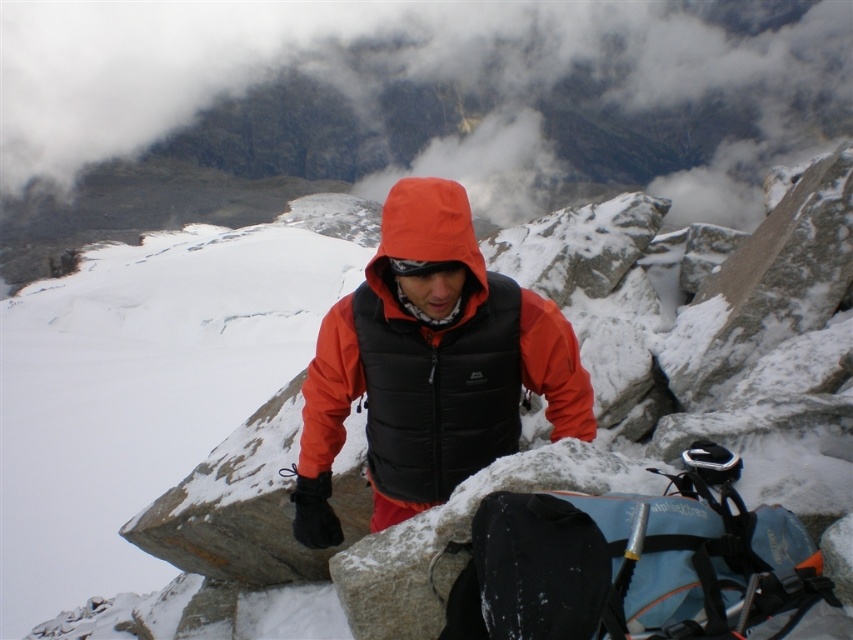
You are a drone operator tasked with capturing aerial footage of the orange softshell jacket at center and the cloudy fog at upper center. The drone has a maximum operational range of 300 meters. Can the drone safely capture footage of both objects without exceeding its range limit?

The cloudy fog at upper center and orange softshell jacket at center are 308.27 meters apart. Since the distance between them exceeds the drone operator maximum operational range of 300 meters, the drone cannot safely capture footage of both objects without exceeding its range limit.

Based on the photo, you are planning to take a photo of the cloudy fog at upper center and the orange softshell jacket at center. Based on their positions, which one should you focus on first to ensure both are in sharp focus?

The cloudy fog at upper center is above the orange softshell jacket at center, so you should focus on the cloudy fog at upper center first to ensure both are in sharp focus since it is farther away.

Consider the image. You are planning to take a photo of the cloudy fog at upper center and the orange softshell jacket at center. Since you want both to be in focus, which one should you focus on first to ensure the other is also sharp?

You should focus on the orange softshell jacket at center first because it is closer to the camera than the cloudy fog at upper center. By focusing on the closer object, the background object will also be in focus due to the depth of field.